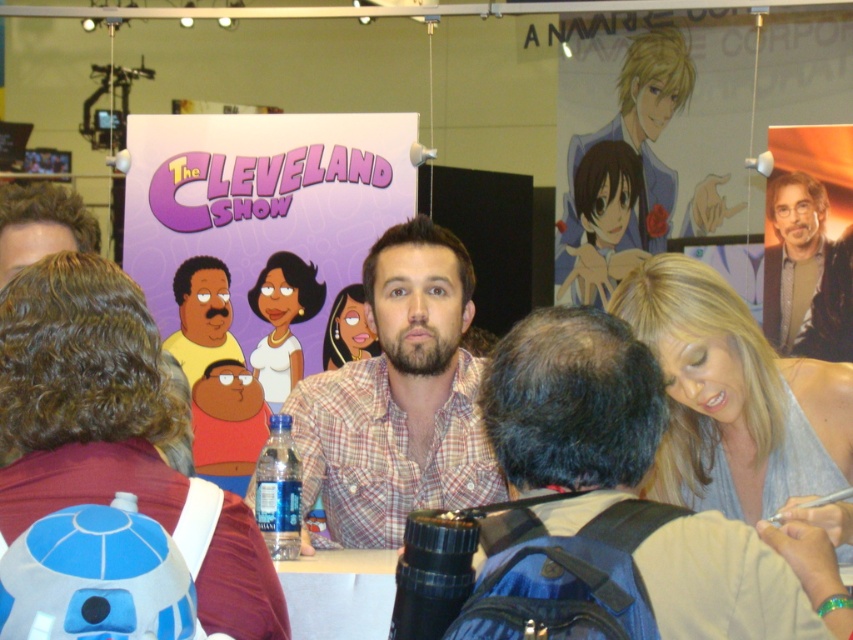
Is shiny silver hair at upper right further to camera compared to smooth skin face at center?

No, shiny silver hair at upper right is in front of smooth skin face at center.

Is shiny silver hair at upper right to the left of smooth skin face at center from the viewer's perspective?

No, shiny silver hair at upper right is not to the left of smooth skin face at center.

Locate an element on the screen. The width and height of the screenshot is (853, 640). shiny silver hair at upper right is located at coordinates (807, 272).

Identify the location of shiny silver hair at upper right. (807, 272).

Does plaid cotton shirt at center appear under smooth white shirt at center?

Yes.

Is point (393, 348) farther from viewer compared to point (288, 268)?

That is False.

I want to click on plaid cotton shirt at center, so click(399, 397).

Between plaid cotton shirt at center and shiny silver hair at upper right, which one appears on the left side from the viewer's perspective?

Positioned to the left is plaid cotton shirt at center.

Can you confirm if plaid cotton shirt at center is positioned below shiny silver hair at upper right?

Yes, plaid cotton shirt at center is below shiny silver hair at upper right.

The height and width of the screenshot is (640, 853). What do you see at coordinates (399, 397) in the screenshot?
I see `plaid cotton shirt at center` at bounding box center [399, 397].

This screenshot has width=853, height=640. In order to click on plaid cotton shirt at center in this screenshot , I will do `click(399, 397)`.